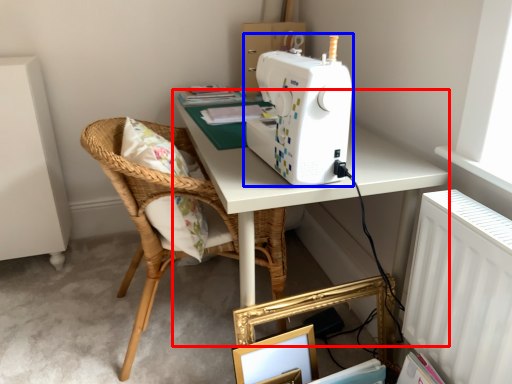
Question: Which object is closer to the camera taking this photo, table (highlighted by a red box) or sewing machine (highlighted by a blue box)?

Choices:
 (A) table
 (B) sewing machine

Answer: (B)